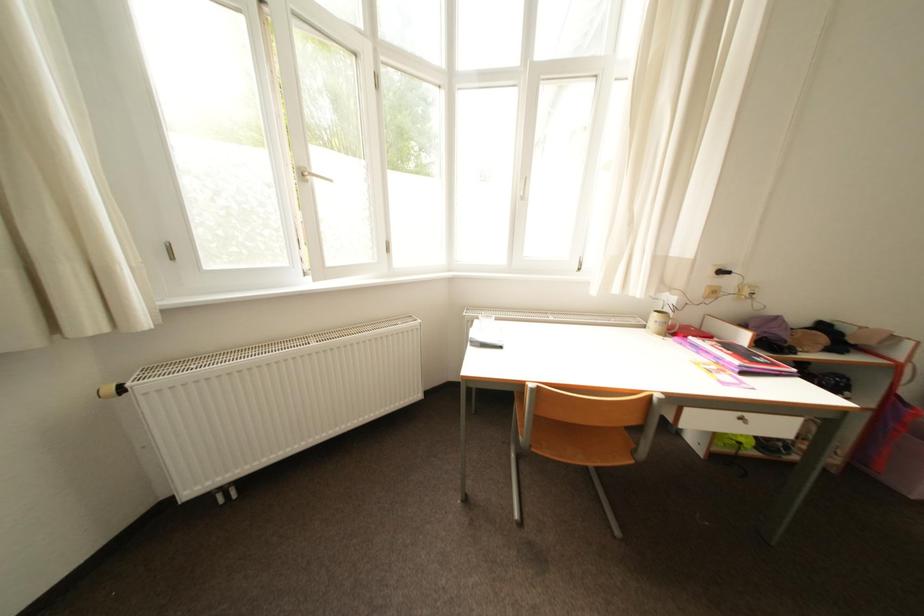
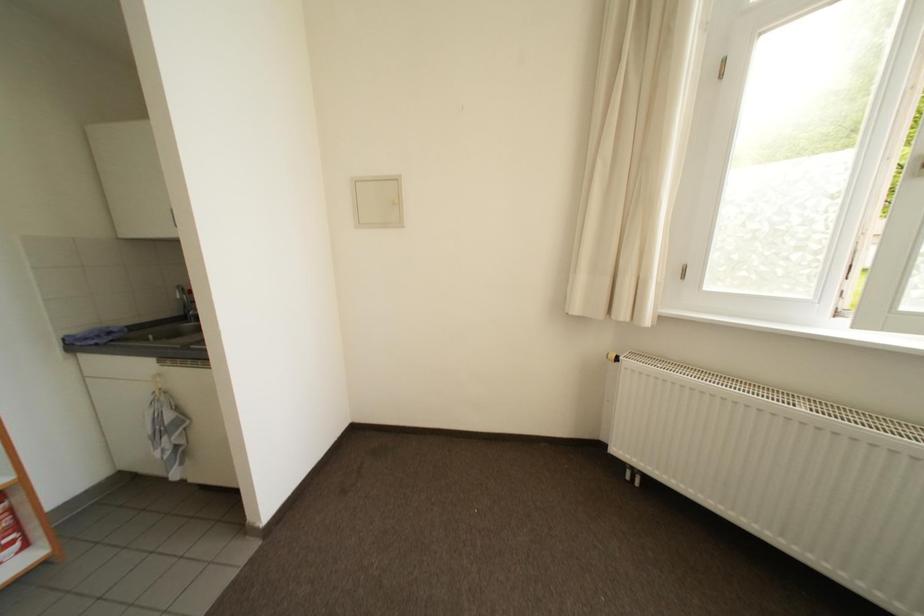
Question: The camera is either moving clockwise (left) or counter-clockwise (right) around the object. The first image is from the beginning of the video and the second image is from the end. Is the camera moving left or right when shooting the video?

Choices:
 (A) Left
 (B) Right

Answer: (B)